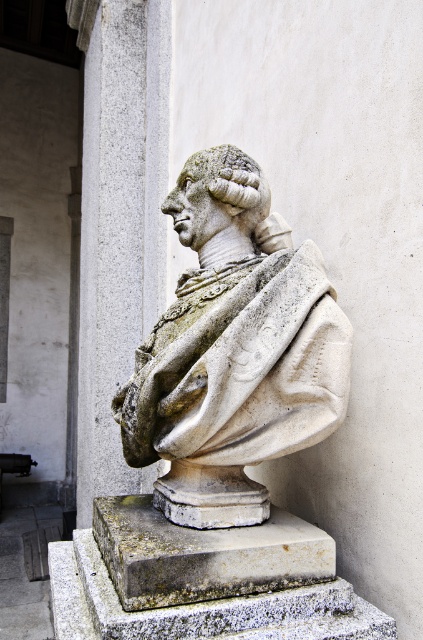
Can you confirm if white stone bust at center is taller than gray stone column at left?

In fact, white stone bust at center may be shorter than gray stone column at left.

Which of these two, white stone bust at center or gray stone column at left, stands taller?

With more height is gray stone column at left.

The image size is (423, 640). I want to click on white stone bust at center, so click(x=233, y=352).